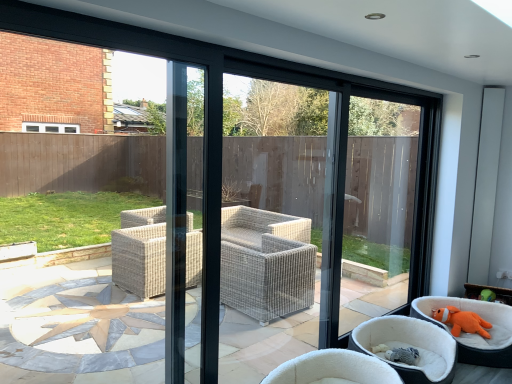
Question: Is orange plush toy at lower right, which is the 2th chair in right-to-left order, inside orange plush toy at lower right, placed as the first chair when sorted from right to left?

Choices:
 (A) yes
 (B) no

Answer: (B)

Question: Could you tell me if orange plush toy at lower right, placed as the first chair when sorted from right to left, is facing orange plush toy at lower right, which is the 2th chair in right-to-left order?

Choices:
 (A) yes
 (B) no

Answer: (B)

Question: Is orange plush toy at lower right, placed as the first chair when sorted from right to left, positioned before orange plush toy at lower right, which is the 2th chair in right-to-left order?

Choices:
 (A) yes
 (B) no

Answer: (B)

Question: Is orange plush toy at lower right, the third chair positioned from the left, thinner than orange plush toy at lower right, which is the 2th chair in right-to-left order?

Choices:
 (A) yes
 (B) no

Answer: (B)

Question: Is orange plush toy at lower right, the third chair positioned from the left, to the left of orange plush toy at lower right, which is the 2th chair from left to right, from the viewer's perspective?

Choices:
 (A) no
 (B) yes

Answer: (A)

Question: Are orange plush toy at lower right, the third chair positioned from the left, and orange plush toy at lower right, which is the 2th chair in right-to-left order, beside each other?

Choices:
 (A) no
 (B) yes

Answer: (A)

Question: Does white wicker chair at center, the first chair from the left, have a larger size compared to orange plush toy at lower right, which is the 2th chair in right-to-left order?

Choices:
 (A) no
 (B) yes

Answer: (B)

Question: From a real-world perspective, is white wicker chair at center, the first chair from the left, beneath orange plush toy at lower right, which is the 2th chair from left to right?

Choices:
 (A) yes
 (B) no

Answer: (A)

Question: Is white wicker chair at center, the first chair from the left, turned away from orange plush toy at lower right, which is the 2th chair from left to right?

Choices:
 (A) no
 (B) yes

Answer: (A)

Question: Is white wicker chair at center, the first chair from the left, aimed at orange plush toy at lower right, which is the 2th chair from left to right?

Choices:
 (A) no
 (B) yes

Answer: (A)

Question: From the image's perspective, is white wicker chair at center, the third chair when ordered from right to left, located beneath orange plush toy at lower right, which is the 2th chair in right-to-left order?

Choices:
 (A) yes
 (B) no

Answer: (A)

Question: Considering the relative sizes of orange plush toy at lower right and orange plush toy at lower right, which is the 2th chair from left to right, in the image provided, is orange plush toy at lower right wider than orange plush toy at lower right, which is the 2th chair from left to right,?

Choices:
 (A) yes
 (B) no

Answer: (B)